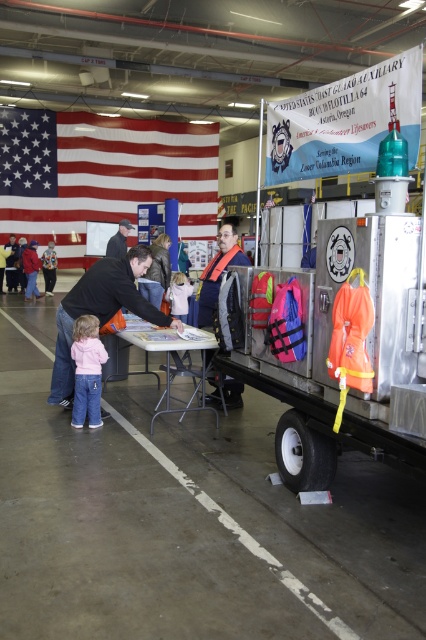
You are a photographer setting up for an event in the hangar. You need to position two pink jackets, the pink fleece jacket at lower left and the pink fabric jacket at lower left, so that they are close enough to be captured in a single photo without moving the camera. Given that your camera has a maximum focus range of 40 feet, will you be able to frame both jackets in one shot?

The distance between the pink fleece jacket at lower left and the pink fabric jacket at lower left is 41.45 feet. Since this exceeds the camera maximum focus range of 40 feet, you will not be able to frame both jackets in one shot without moving the camera.